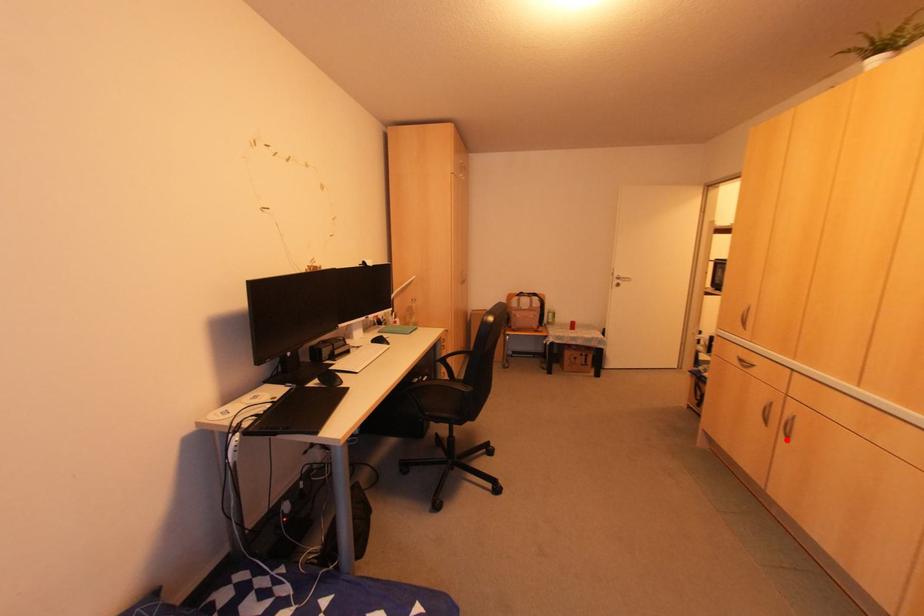
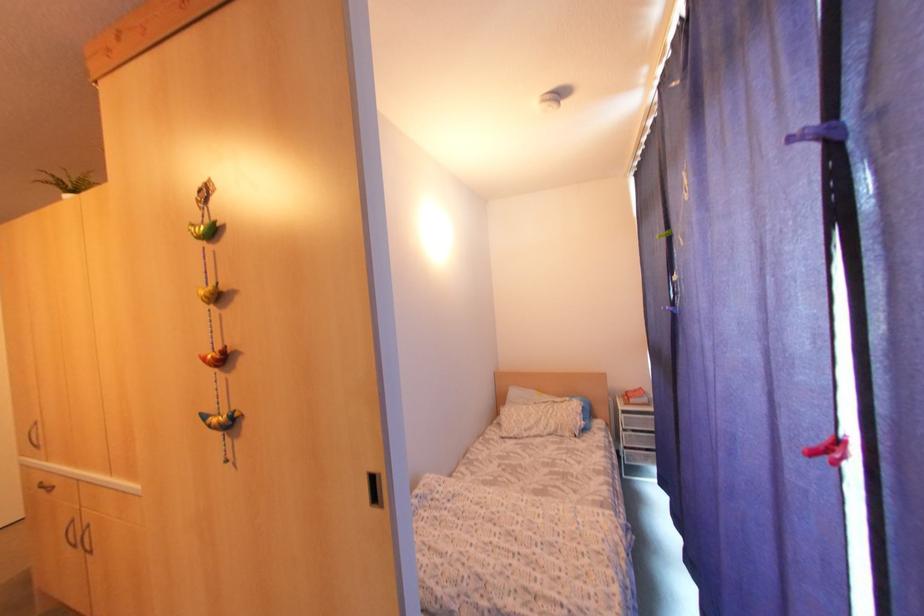
Find the pixel in the second image that matches the highlighted location in the first image.

(90, 552)